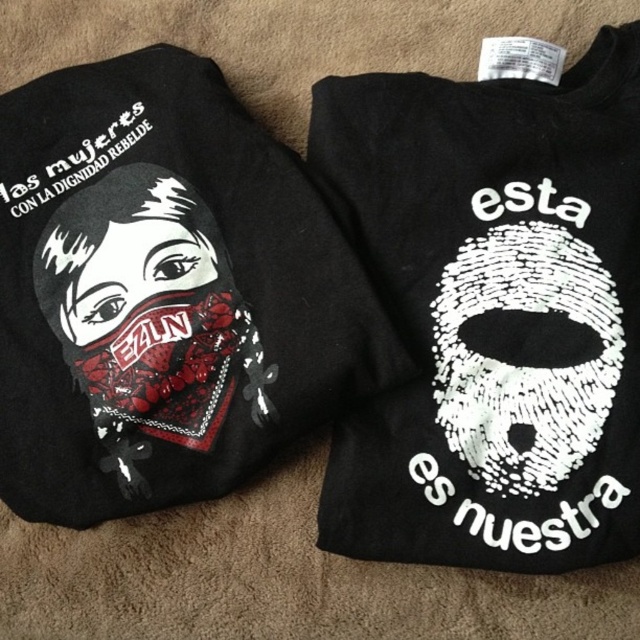
You are standing in a room where two points are marked on the floor. One is at point (580, 465) and the other is at point (266, 141). Which point is closer to you?

Point (580, 465) is in front of point (266, 141), so it is closer to you.